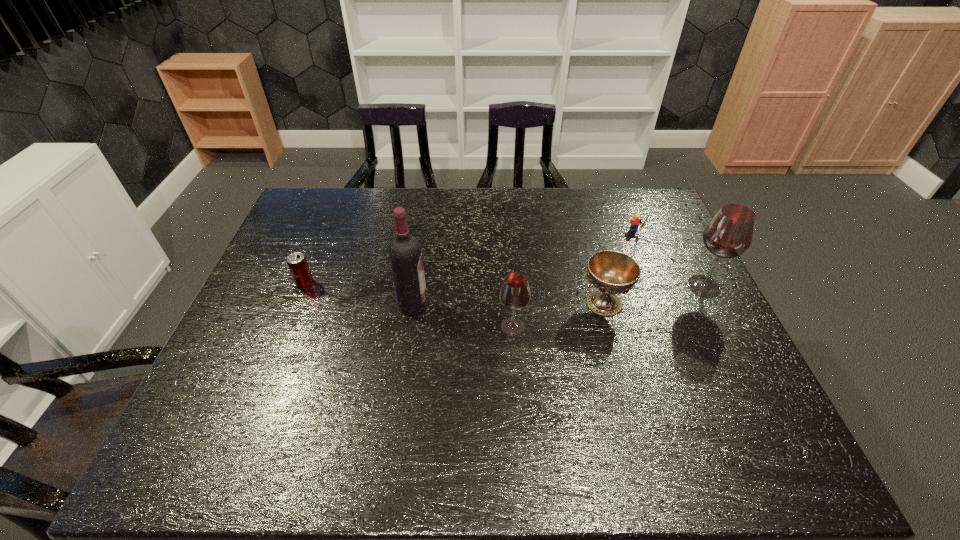
Please point a free position for a wineglass on the left. Please provide its 2D coordinates. Your answer should be formatted as a tuple, i.e. [(x, y)], where the tuple contains the x and y coordinates of a point satisfying the conditions above.

[(282, 376)]